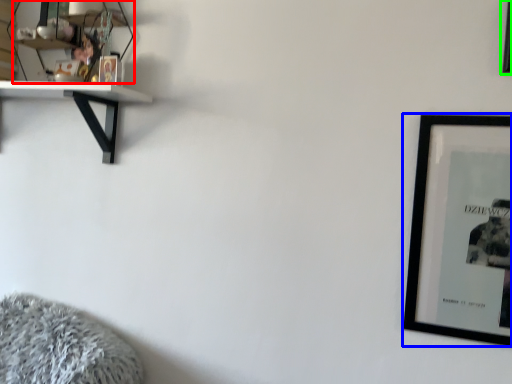
Question: Which object is positioned closest to shelf (highlighted by a red box)? Select from picture frame (highlighted by a blue box) and picture frame (highlighted by a green box).

Choices:
 (A) picture frame
 (B) picture frame

Answer: (A)